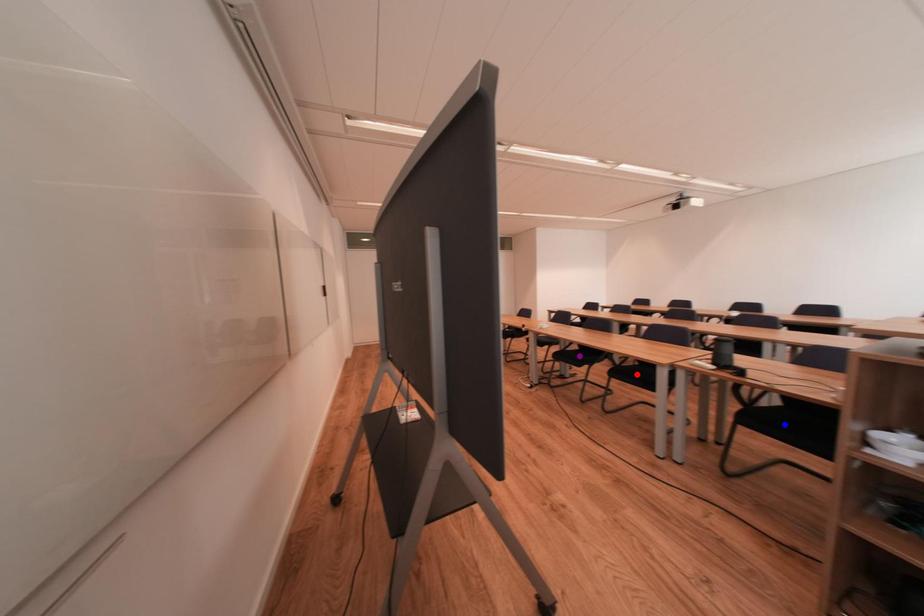
Order these from nearest to farthest:
purple point, blue point, red point

blue point < red point < purple point